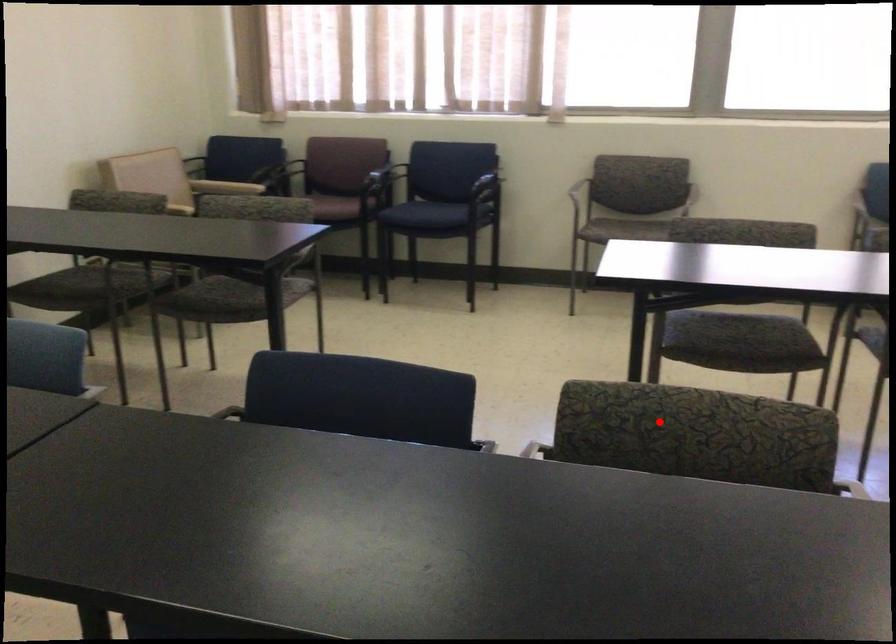
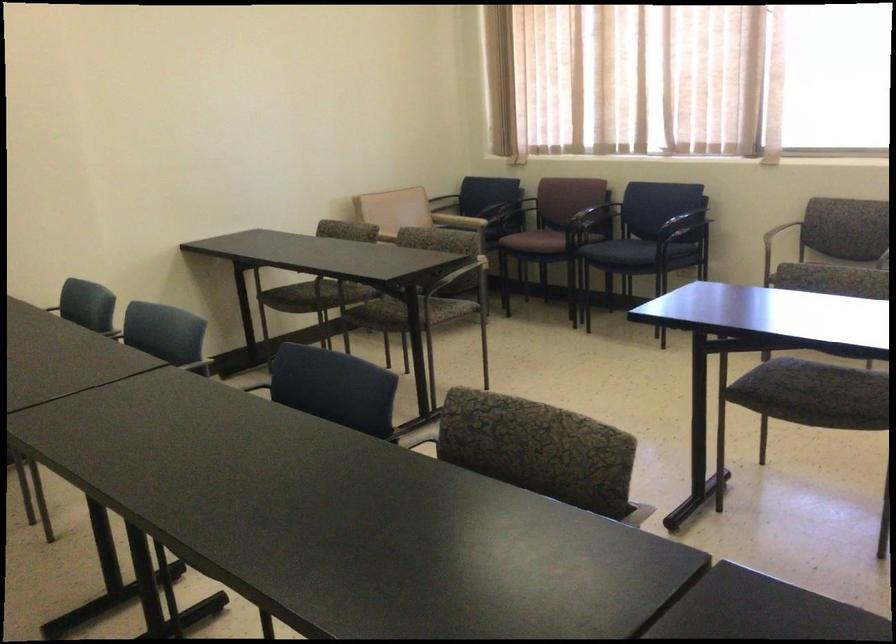
Question: I am providing you with two images of the same scene from different viewpoints. A red point is shown in image1. For the corresponding object point in image2, is it positioned nearer or farther from the camera?

Choices:
 (A) Nearer
 (B) Farther

Answer: (B)